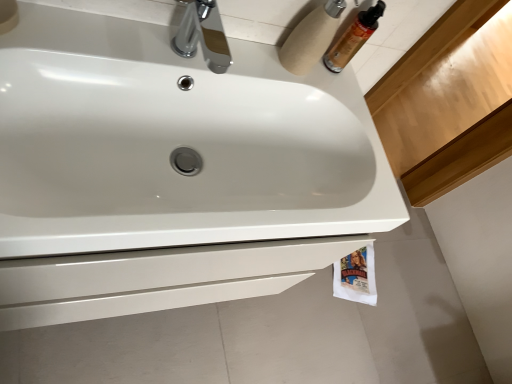
Where is `vacant space in front of translucent plastic mouthwash at upper right`? The height and width of the screenshot is (384, 512). vacant space in front of translucent plastic mouthwash at upper right is located at coordinates (288, 69).